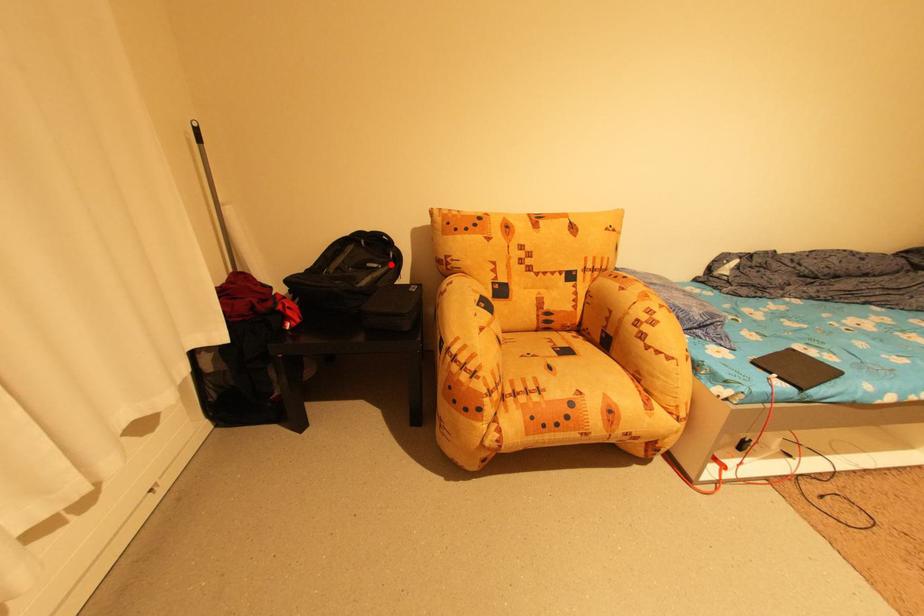
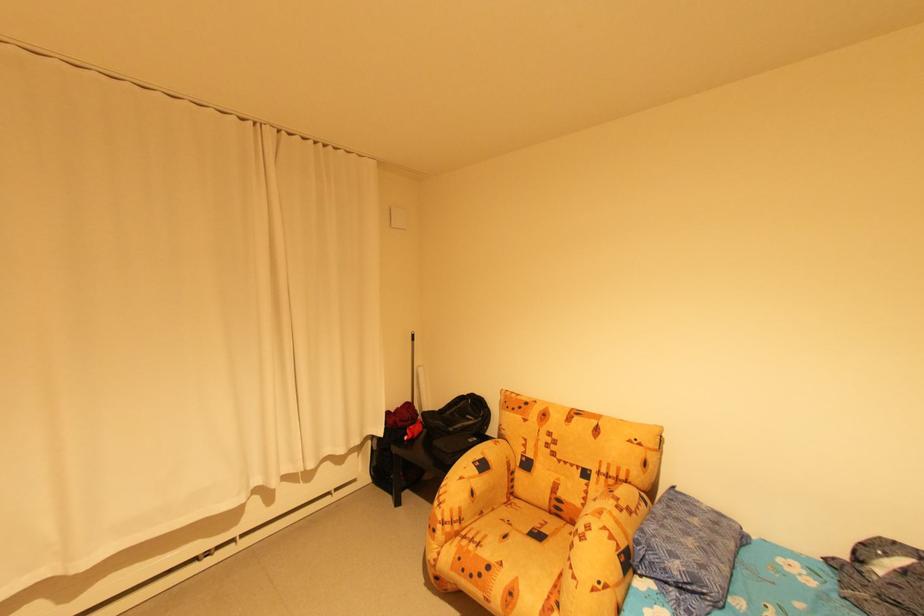
Locate, in the second image, the point that corresponds to the highlighted location in the first image.

(482, 419)